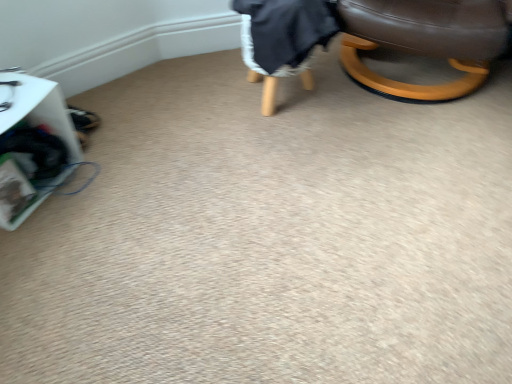
Question: Considering the positions of dark gray fabric bean bag chair at upper right and brown leather chair at upper right in the image, is dark gray fabric bean bag chair at upper right wider or thinner than brown leather chair at upper right?

Choices:
 (A) thin
 (B) wide

Answer: (A)

Question: From the image's perspective, relative to brown leather chair at upper right, is dark gray fabric bean bag chair at upper right above or below?

Choices:
 (A) above
 (B) below

Answer: (B)

Question: Which object is the closest to the white plastic basket at left?

Choices:
 (A) dark gray fabric bean bag chair at upper right
 (B) brown leather chair at upper right

Answer: (A)

Question: Which object is the farthest from the brown leather chair at upper right?

Choices:
 (A) dark gray fabric bean bag chair at upper right
 (B) white plastic basket at left

Answer: (B)